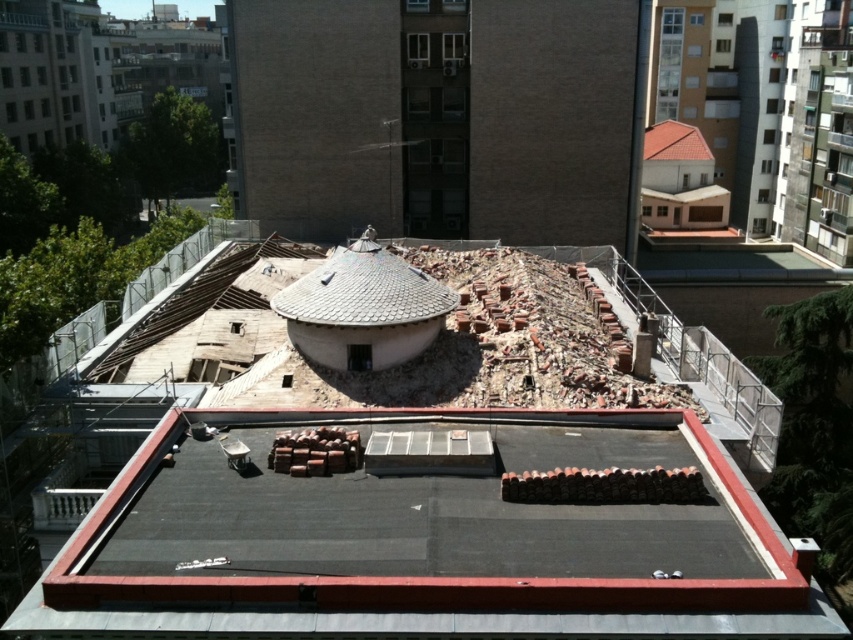
Between point (119, 547) and point (694, 129), which one is positioned behind?

The point (694, 129) is more distant.

Does black rubber roof at center have a greater width compared to red shingles at upper right?

Correct, the width of black rubber roof at center exceeds that of red shingles at upper right.

Which is behind, point (392, 608) or point (651, 157)?

Positioned behind is point (651, 157).

You are a GUI agent. You are given a task and a screenshot of the screen. Output one action in this format:
    pyautogui.click(x=<x>, y=<y>)
    Task: Click on the black rubber roof at center
    
    Given the screenshot: What is the action you would take?
    pyautogui.click(x=432, y=516)

Which of these two, gray tile dome at center or red shingles at upper right, stands taller?

Standing taller between the two is gray tile dome at center.

At what (x,y) coordinates should I click in order to perform the action: click on gray tile dome at center. Please return your answer as a coordinate pair (x, y). This screenshot has height=640, width=853. Looking at the image, I should click on (364, 291).

Which is in front, point (325, 314) or point (686, 129)?

Point (325, 314) is in front.

The image size is (853, 640). In order to click on gray tile dome at center in this screenshot , I will do `click(364, 291)`.

The image size is (853, 640). What are the coordinates of `brick rubble at center` in the screenshot? It's located at (415, 499).

Between brick rubble at center and black rubber roof at center, which one is positioned higher?

brick rubble at center is above.

Is point (639, 550) in front of point (299, 474)?

Yes, it is in front of point (299, 474).

You are a GUI agent. You are given a task and a screenshot of the screen. Output one action in this format:
    pyautogui.click(x=<x>, y=<y>)
    Task: Click on the brick rubble at center
    This screenshot has height=640, width=853.
    Given the screenshot: What is the action you would take?
    coord(415,499)